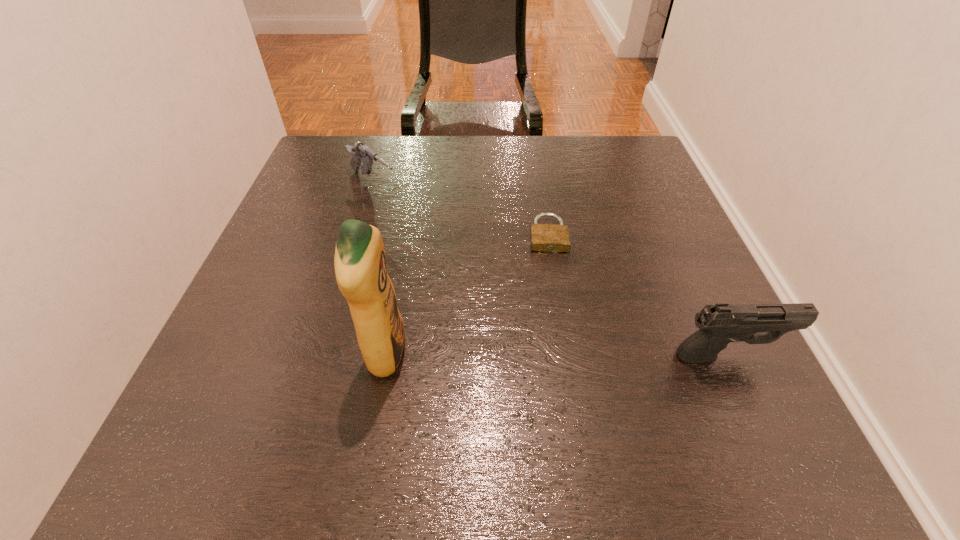
Where is `the second object from left to right`? The width and height of the screenshot is (960, 540). the second object from left to right is located at coordinates (360, 263).

This screenshot has width=960, height=540. What are the coordinates of `detergent` in the screenshot? It's located at (360, 263).

Identify the location of the second tallest object. The width and height of the screenshot is (960, 540). (720, 324).

Identify the location of the rightmost object. The image size is (960, 540). (720, 324).

What are the coordinates of `padlock` in the screenshot? It's located at (544, 237).

Where is `the third object from left to right`? the third object from left to right is located at coordinates (544, 237).

This screenshot has width=960, height=540. I want to click on the second shortest object, so click(360, 152).

I want to click on gun, so click(x=360, y=152).

In order to click on free point located 0.360m on the label of the second object from left to right in this screenshot , I will do `click(614, 354)`.

This screenshot has height=540, width=960. I want to click on blank space located on the keyhole side of the padlock, so click(557, 327).